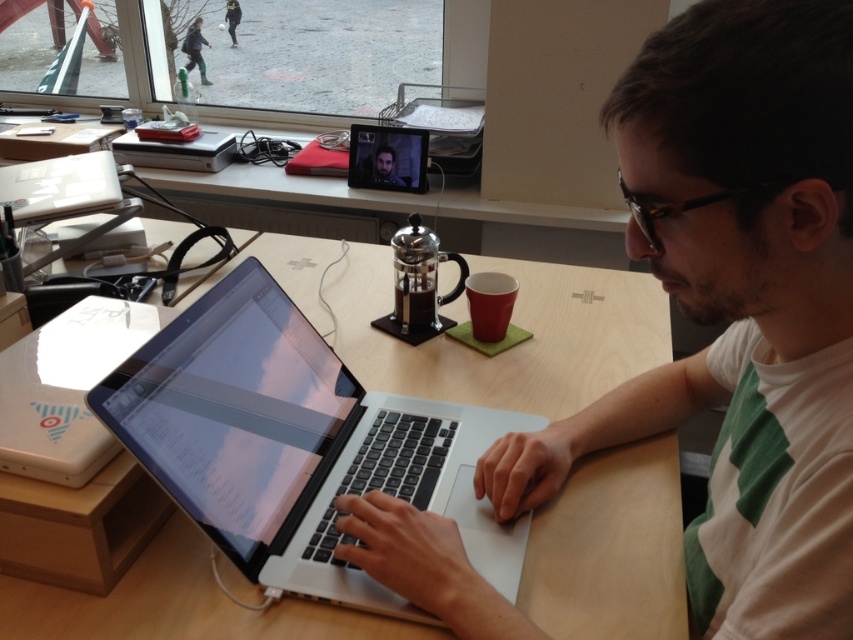
Question: Which object is the farthest from the white cotton shirt at center?

Choices:
 (A) white plastic laptop at center
 (B) sleek silver laptop at center

Answer: (A)

Question: Which object is farther from the camera taking this photo?

Choices:
 (A) white plastic laptop at center
 (B) sleek silver laptop at center

Answer: (A)

Question: Is white cotton shirt at center behind white plastic laptop at center?

Choices:
 (A) no
 (B) yes

Answer: (A)

Question: Is white cotton shirt at center positioned in front of white plastic laptop at center?

Choices:
 (A) yes
 (B) no

Answer: (A)

Question: Which object appears farthest from the camera in this image?

Choices:
 (A) white plastic laptop at center
 (B) white cotton shirt at center

Answer: (A)

Question: Does sleek silver laptop at center have a lesser width compared to white plastic laptop at center?

Choices:
 (A) yes
 (B) no

Answer: (B)